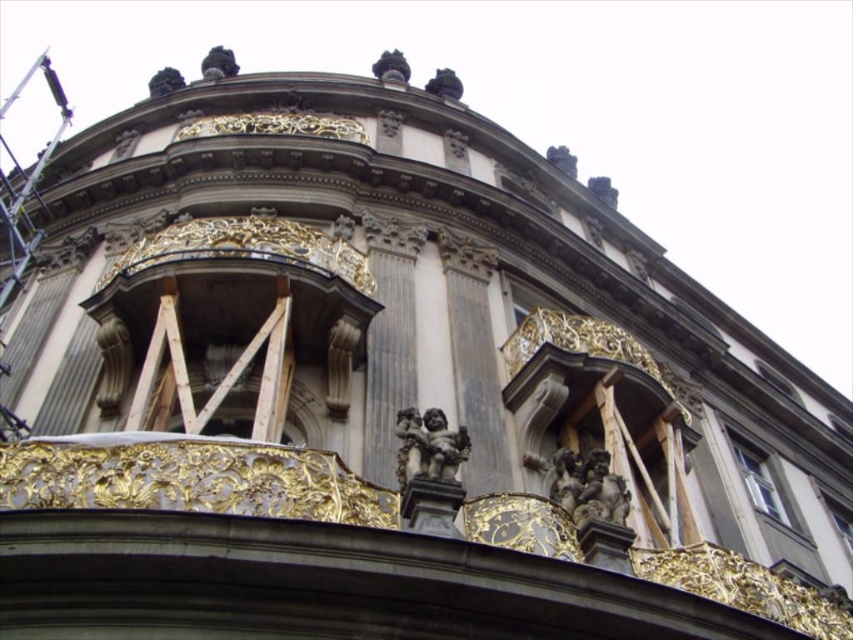
You are an architect designing a model of this building. You need to place both the gray stone cherubim at center and the polished bronze cherub at center on a miniature replica. Given their sizes, which one should you place closer to the front of the model to maintain the original perspective?

The gray stone cherubim at center has a lesser width compared to the polished bronze cherub at center, so to maintain the original perspective, the smaller gray stone cherubim at center should be placed closer to the front of the model. This placement mimics the depth perception where smaller objects appear closer, aligning with their relative sizes in the original structure.

You are an art conservator examining the facade of this historical building. You notice two cherubim sculptures at the center of the dome. Which one is closer to you, the gray stone cherubim at center or the polished bronze cherub at center?

The gray stone cherubim at center is closer to you because it is positioned further to the viewer than the polished bronze cherub at center.